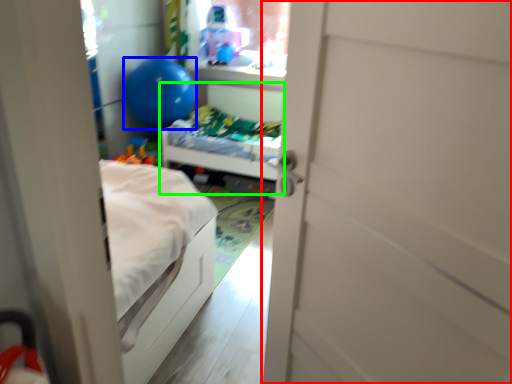
Question: Which object is the closest to the door (highlighted by a red box)? Choose among these: balloon (highlighted by a blue box) or hospital bed (highlighted by a green box).

Choices:
 (A) balloon
 (B) hospital bed

Answer: (B)